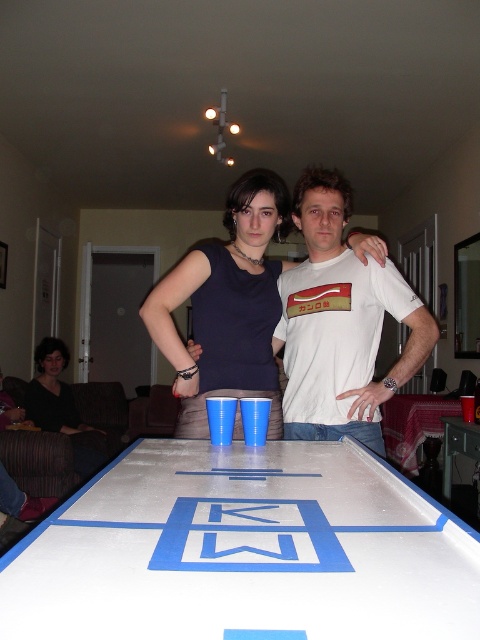
Can you confirm if white painted wood table at center is taller than white glossy table at center?

In fact, white painted wood table at center may be shorter than white glossy table at center.

Who is positioned more to the right, white painted wood table at center or white glossy table at center?

white glossy table at center

The width and height of the screenshot is (480, 640). I want to click on white painted wood table at center, so click(244, 552).

Describe the element at coordinates (340, 323) in the screenshot. The width and height of the screenshot is (480, 640). I see `white matte t-shirt at center` at that location.

In the scene shown: Is white matte t-shirt at center wider than matte blue tank top at center?

Incorrect, white matte t-shirt at center's width does not surpass matte blue tank top at center's.

Between point (327, 204) and point (265, 278), which one is positioned behind?

Positioned behind is point (265, 278).

Find the location of a particular element. Image resolution: width=480 pixels, height=640 pixels. white matte t-shirt at center is located at coordinates (340, 323).

Does point (205, 285) lie behind point (44, 346)?

That is False.

Which is behind, point (166, 324) or point (52, 417)?

The point (52, 417) is more distant.

Locate an element on the screen. matte blue tank top at center is located at coordinates (227, 305).